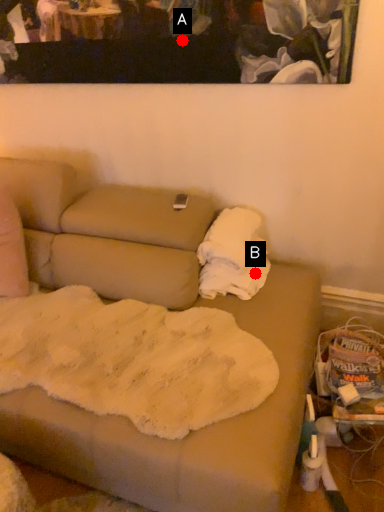
Question: Two points are circled on the image, labeled by A and B beside each circle. Among these points, which one is farthest from the camera?

Choices:
 (A) A is further
 (B) B is further

Answer: (B)